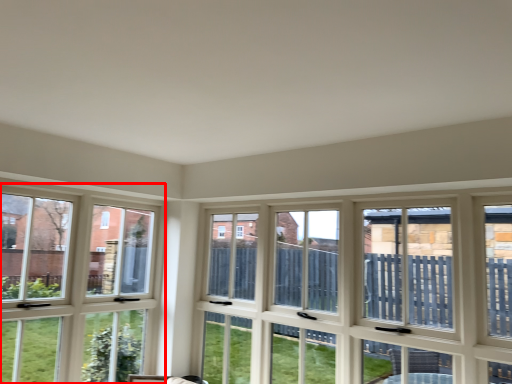
Question: From the image's perspective, considering the relative positions of window (annotated by the red box) and window in the image provided, where is window (annotated by the red box) located with respect to the staircase?

Choices:
 (A) above
 (B) below

Answer: (A)